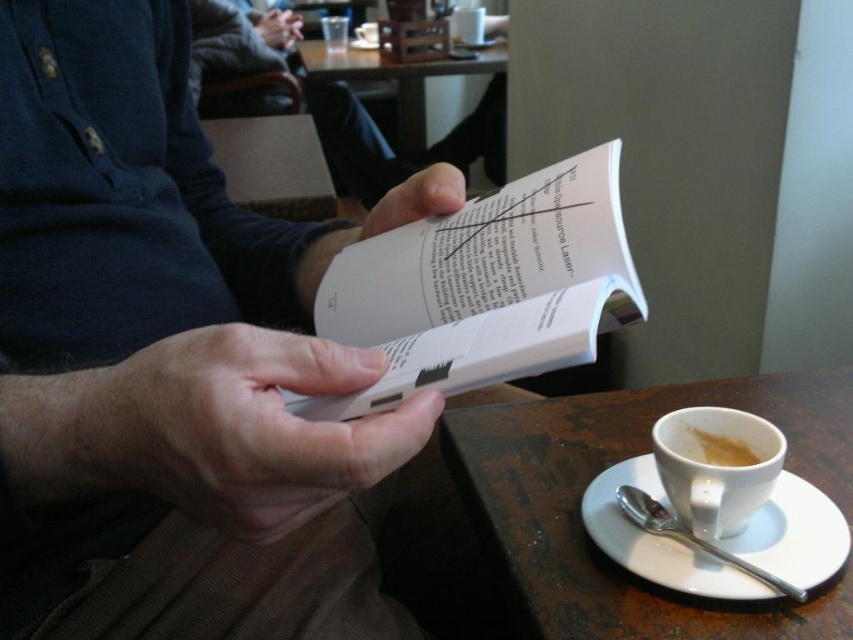
Who is lower down, wooden table at center or white paper at center?

white paper at center

Is wooden table at center bigger than white paper at center?

Yes, wooden table at center is bigger than white paper at center.

Between point (322, 77) and point (410, 196), which one is positioned in front?

Positioned in front is point (410, 196).

At what (x,y) coordinates should I click in order to perform the action: click on wooden table at center. Please return your answer as a coordinate pair (x, y). Looking at the image, I should click on (398, 77).

Between brown wooden table at lower right and smooth skin hand at upper center, which one appears on the left side from the viewer's perspective?

From the viewer's perspective, smooth skin hand at upper center appears more on the left side.

Which is in front, point (751, 604) or point (270, 35)?

Positioned in front is point (751, 604).

The width and height of the screenshot is (853, 640). I want to click on brown wooden table at lower right, so click(611, 465).

Does white ceramic saucer at lower right have a smaller size compared to white matte cup at lower right?

No, white ceramic saucer at lower right is not smaller than white matte cup at lower right.

Between white ceramic saucer at lower right and white matte cup at lower right, which one appears on the right side from the viewer's perspective?

From the viewer's perspective, white matte cup at lower right appears more on the right side.

Does point (737, 548) come in front of point (744, 451)?

Yes.

Locate an element on the screen. Image resolution: width=853 pixels, height=640 pixels. white ceramic saucer at lower right is located at coordinates (659, 540).